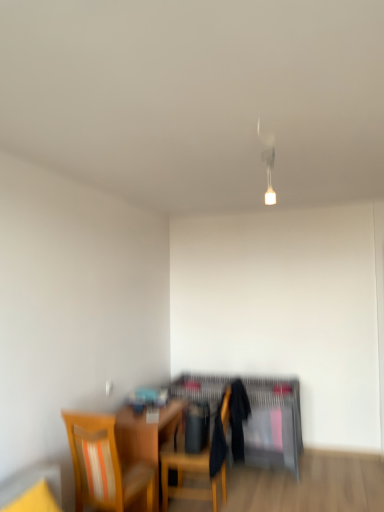
Question: Is wooden chair with striped cushion at lower left, which is the 1th chair from left to right, thinner than matte black desk at center?

Choices:
 (A) no
 (B) yes

Answer: (B)

Question: From the image's perspective, would you say wooden chair with striped cushion at lower left, the first chair in the front-to-back sequence, is shown under matte black desk at center?

Choices:
 (A) no
 (B) yes

Answer: (A)

Question: From the image's perspective, is wooden chair with striped cushion at lower left, marked as the 2th chair in a back-to-front arrangement, over matte black desk at center?

Choices:
 (A) no
 (B) yes

Answer: (B)

Question: Is wooden chair with striped cushion at lower left, which is the 1th chair from left to right, closer to the viewer compared to matte black desk at center?

Choices:
 (A) no
 (B) yes

Answer: (B)

Question: Is wooden chair with striped cushion at lower left, acting as the second chair starting from the right, bigger than matte black desk at center?

Choices:
 (A) yes
 (B) no

Answer: (B)

Question: Which is correct: wooden table at center is inside wooden chair at center, which is counted as the second chair, starting from the front, or outside of it?

Choices:
 (A) inside
 (B) outside

Answer: (B)

Question: In terms of size, does wooden table at center appear bigger or smaller than wooden chair at center, the first chair in the back-to-front sequence?

Choices:
 (A) big
 (B) small

Answer: (B)

Question: Considering the positions of point (137, 431) and point (230, 394), is point (137, 431) closer or farther from the camera than point (230, 394)?

Choices:
 (A) farther
 (B) closer

Answer: (B)

Question: Is wooden table at center taller or shorter than wooden chair at center, which is counted as the second chair, starting from the front?

Choices:
 (A) short
 (B) tall

Answer: (A)

Question: In the image, is matte black desk at center positioned in front of or behind wooden table at center?

Choices:
 (A) behind
 (B) front

Answer: (A)

Question: From the image's perspective, relative to wooden table at center, is matte black desk at center above or below?

Choices:
 (A) above
 (B) below

Answer: (B)

Question: From a real-world perspective, is matte black desk at center physically located above or below wooden table at center?

Choices:
 (A) above
 (B) below

Answer: (A)

Question: From their relative heights in the image, would you say matte black desk at center is taller or shorter than wooden table at center?

Choices:
 (A) short
 (B) tall

Answer: (B)

Question: Considering the positions of wooden table at center and matte black desk at center in the image, is wooden table at center taller or shorter than matte black desk at center?

Choices:
 (A) tall
 (B) short

Answer: (B)

Question: Is point (157, 442) closer or farther from the camera than point (279, 417)?

Choices:
 (A) farther
 (B) closer

Answer: (B)